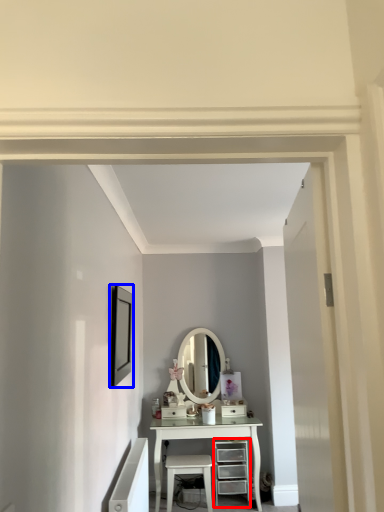
Question: Which of the following is the closest to the observer, chest of drawers (highlighted by a red box) or picture frame (highlighted by a blue box)?

Choices:
 (A) chest of drawers
 (B) picture frame

Answer: (B)